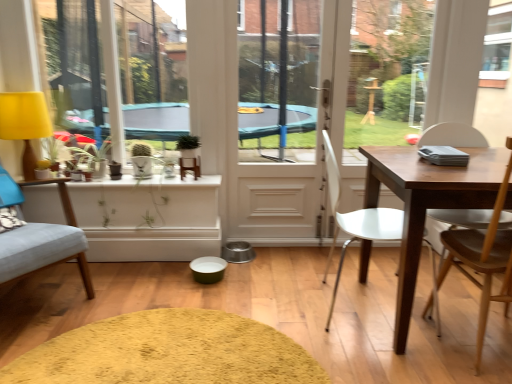
I want to click on vacant location below soft yellow rug at center (from a real-world perspective), so click(x=175, y=337).